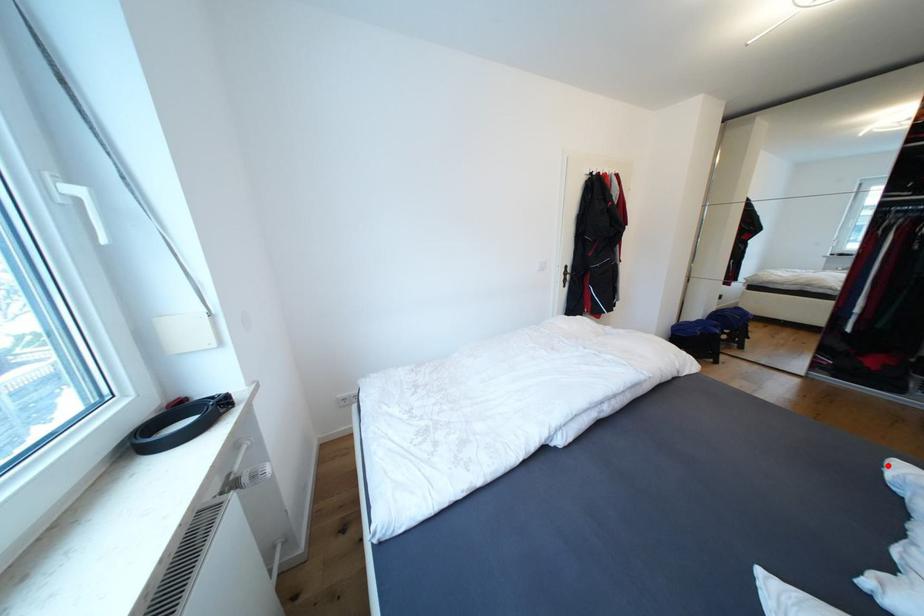
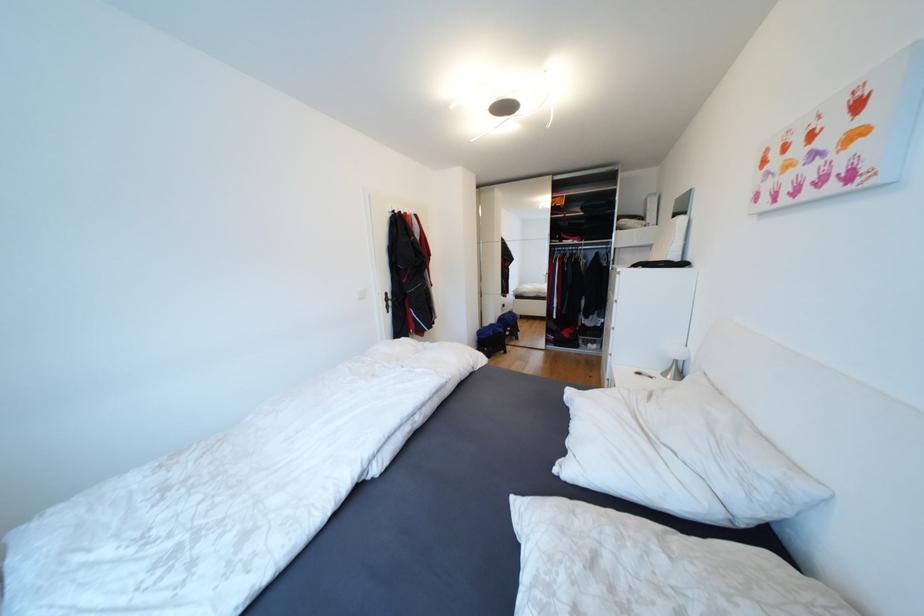
In the second image, find the point that corresponds to the highlighted location in the first image.

(570, 394)